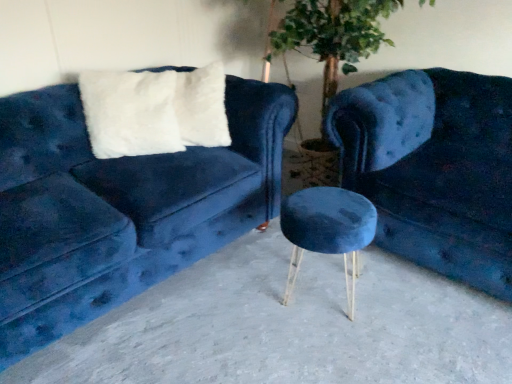
Question: Would you say velvet blue stool at center is to the left or to the right of smooth concrete stool at center in the picture?

Choices:
 (A) right
 (B) left

Answer: (A)

Question: From the image's perspective, is velvet blue stool at center positioned above or below smooth concrete stool at center?

Choices:
 (A) below
 (B) above

Answer: (B)

Question: Which object is the farthest from the white fluffy pillow at upper left?

Choices:
 (A) smooth concrete stool at center
 (B) velvet blue stool at center
 (C) velvet blue couch at left, which is counted as the 1th studio couch, starting from the left
 (D) velvet blue couch at center, the first studio couch viewed from the right

Answer: (D)

Question: Estimate the real-world distances between objects in this image. Which object is closer to the velvet blue stool at center?

Choices:
 (A) smooth concrete stool at center
 (B) velvet blue couch at center, placed as the second studio couch when sorted from left to right
 (C) white fluffy pillow at upper left
 (D) velvet blue couch at left, marked as the 2th studio couch in a right-to-left arrangement

Answer: (A)